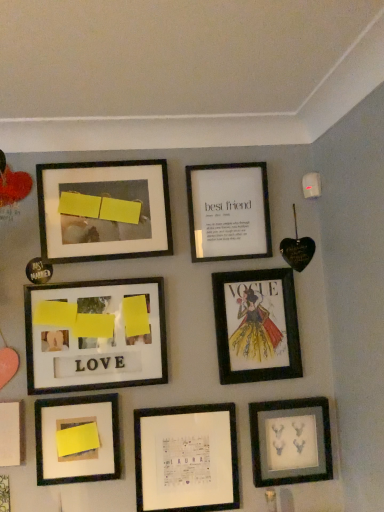
Question: Is matte paper vogue cover at center right, the 7th picture frame from the bottom, oriented away from matte yellow paper at center left, placed as the sixth picture frame when sorted from bottom to top?

Choices:
 (A) no
 (B) yes

Answer: (A)

Question: Is matte paper vogue cover at center right, the 7th picture frame from the bottom, not inside matte yellow paper at center left, placed as the sixth picture frame when sorted from bottom to top?

Choices:
 (A) no
 (B) yes

Answer: (B)

Question: Is matte paper vogue cover at center right, the 7th picture frame from the bottom, next to matte yellow paper at center left, the 4th picture frame viewed from the top?

Choices:
 (A) no
 (B) yes

Answer: (A)

Question: Is matte yellow paper at center left, the 4th picture frame viewed from the top, completely or partially inside matte paper vogue cover at center right, the 7th picture frame from the bottom?

Choices:
 (A) no
 (B) yes

Answer: (A)

Question: Is matte paper vogue cover at center right, positioned as the 3th picture frame in top-to-bottom order, shorter than matte yellow paper at center left, the 4th picture frame viewed from the top?

Choices:
 (A) yes
 (B) no

Answer: (B)

Question: Considering the positions of white paper at upper center, which appears as the 1th picture frame when viewed from the top, and matte black deer heads at lower right, acting as the third picture frame starting from the bottom, in the image, is white paper at upper center, which appears as the 1th picture frame when viewed from the top, taller or shorter than matte black deer heads at lower right, acting as the third picture frame starting from the bottom,?

Choices:
 (A) tall
 (B) short

Answer: (A)

Question: Is point (256, 173) closer or farther from the camera than point (304, 401)?

Choices:
 (A) farther
 (B) closer

Answer: (A)

Question: Based on their sizes in the image, would you say white paper at upper center, arranged as the 9th picture frame when ordered from the bottom, is bigger or smaller than matte black deer heads at lower right, acting as the third picture frame starting from the bottom?

Choices:
 (A) small
 (B) big

Answer: (B)

Question: From the image's perspective, relative to matte black deer heads at lower right, which is counted as the 7th picture frame, starting from the top, is white paper at upper center, which appears as the 1th picture frame when viewed from the top, above or below?

Choices:
 (A) above
 (B) below

Answer: (A)

Question: Does point (13, 422) appear closer or farther from the camera than point (157, 342)?

Choices:
 (A) closer
 (B) farther

Answer: (A)

Question: Would you say white matte paper at lower left, the 5th picture frame from the bottom, is to the left or to the right of matte yellow paper at center left, placed as the sixth picture frame when sorted from bottom to top, in the picture?

Choices:
 (A) right
 (B) left

Answer: (B)

Question: In terms of width, does white matte paper at lower left, the 5th picture frame from the bottom, look wider or thinner when compared to matte yellow paper at center left, the 4th picture frame viewed from the top?

Choices:
 (A) wide
 (B) thin

Answer: (A)

Question: Considering the positions of white matte paper at lower left, the 5th picture frame in the top-to-bottom sequence, and matte yellow paper at center left, placed as the sixth picture frame when sorted from bottom to top, in the image, is white matte paper at lower left, the 5th picture frame in the top-to-bottom sequence, bigger or smaller than matte yellow paper at center left, placed as the sixth picture frame when sorted from bottom to top,?

Choices:
 (A) big
 (B) small

Answer: (B)

Question: From the image's perspective, is matte yellow sticky note at lower left, marked as the 4th picture frame in a bottom-to-top arrangement, located above or below matte black frame at upper left, which appears as the eighth picture frame when ordered from the bottom?

Choices:
 (A) above
 (B) below

Answer: (B)

Question: From their relative heights in the image, would you say matte yellow sticky note at lower left, placed as the 6th picture frame when sorted from top to bottom, is taller or shorter than matte black frame at upper left, which appears as the eighth picture frame when ordered from the bottom?

Choices:
 (A) tall
 (B) short

Answer: (B)